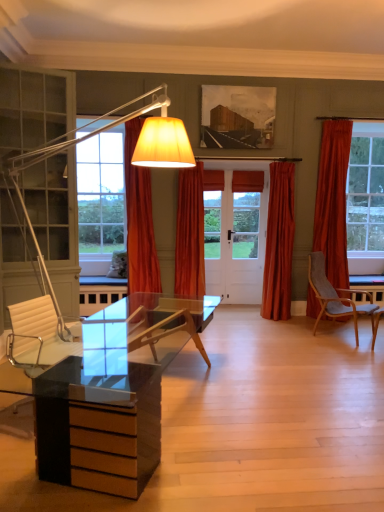
Question: Can you confirm if orange fabric curtain at center, the third curtain viewed from the right, is shorter than velvet orange curtain at center, which ranks as the third curtain in left-to-right order?

Choices:
 (A) no
 (B) yes

Answer: (A)

Question: From the image's perspective, is orange fabric curtain at center, the 1th curtain positioned from the left, on velvet orange curtain at center, which ranks as the third curtain in left-to-right order?

Choices:
 (A) yes
 (B) no

Answer: (A)

Question: Does orange fabric curtain at center, the third curtain viewed from the right, appear on the right side of velvet orange curtain at center, marked as the 1th curtain in a right-to-left arrangement?

Choices:
 (A) no
 (B) yes

Answer: (A)

Question: Does orange fabric curtain at center, the third curtain viewed from the right, have a smaller size compared to velvet orange curtain at center, which ranks as the third curtain in left-to-right order?

Choices:
 (A) yes
 (B) no

Answer: (B)

Question: Does orange fabric curtain at center, the third curtain viewed from the right, lie in front of velvet orange curtain at center, marked as the 1th curtain in a right-to-left arrangement?

Choices:
 (A) no
 (B) yes

Answer: (B)

Question: From a real-world perspective, is orange fabric curtain at center, the third curtain viewed from the right, under velvet orange curtain at center, which ranks as the third curtain in left-to-right order?

Choices:
 (A) no
 (B) yes

Answer: (A)

Question: Is orange fabric curtain at center, the third curtain viewed from the right, shorter than fluffy white pillow at left?

Choices:
 (A) yes
 (B) no

Answer: (B)

Question: Is orange fabric curtain at center, the 1th curtain positioned from the left, positioned far away from fluffy white pillow at left?

Choices:
 (A) no
 (B) yes

Answer: (B)

Question: Is orange fabric curtain at center, the 1th curtain positioned from the left, directly adjacent to fluffy white pillow at left?

Choices:
 (A) yes
 (B) no

Answer: (B)

Question: Does orange fabric curtain at center, the third curtain viewed from the right, come behind fluffy white pillow at left?

Choices:
 (A) yes
 (B) no

Answer: (B)

Question: Can you confirm if orange fabric curtain at center, the 1th curtain positioned from the left, is taller than fluffy white pillow at left?

Choices:
 (A) no
 (B) yes

Answer: (B)

Question: From a real-world perspective, is orange fabric curtain at center, the third curtain viewed from the right, physically above fluffy white pillow at left?

Choices:
 (A) yes
 (B) no

Answer: (A)

Question: Does wooden textured painting at upper center touch fluffy white pillow at left?

Choices:
 (A) yes
 (B) no

Answer: (B)